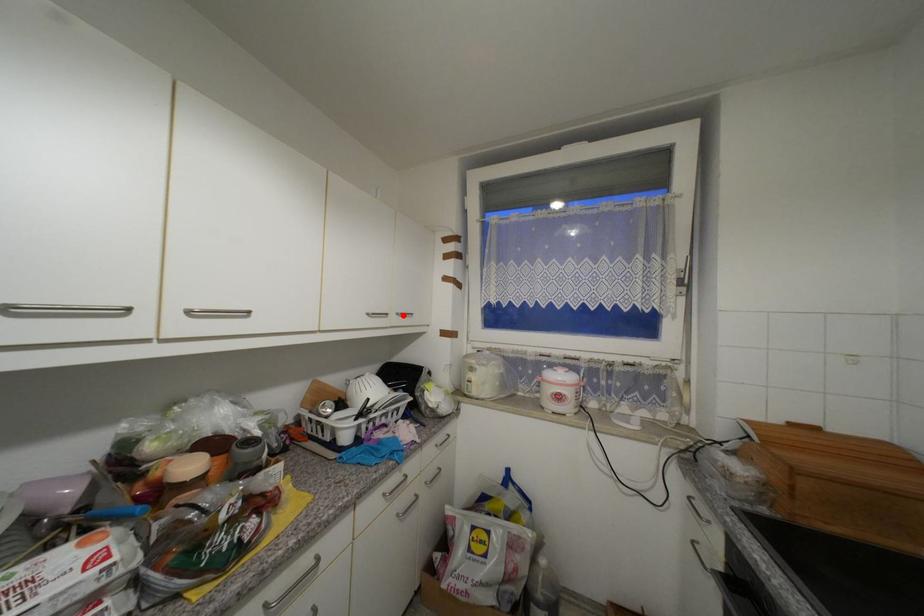
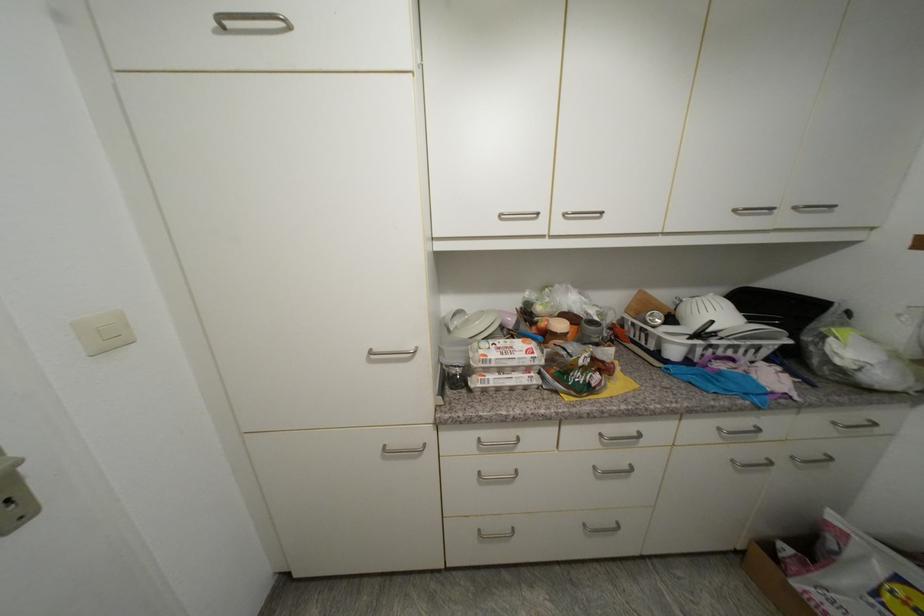
Find the pixel in the second image that matches the highlighted location in the first image.

(800, 209)